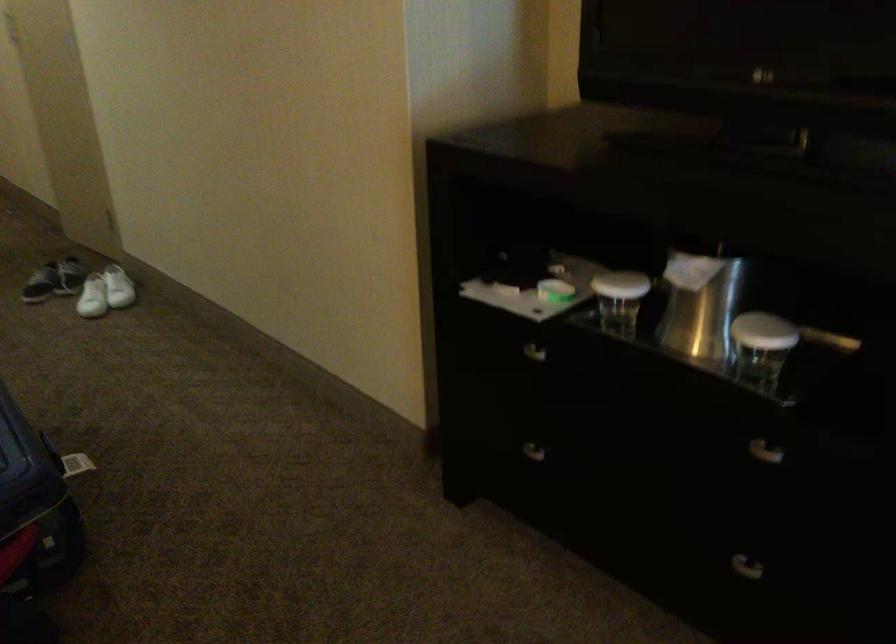
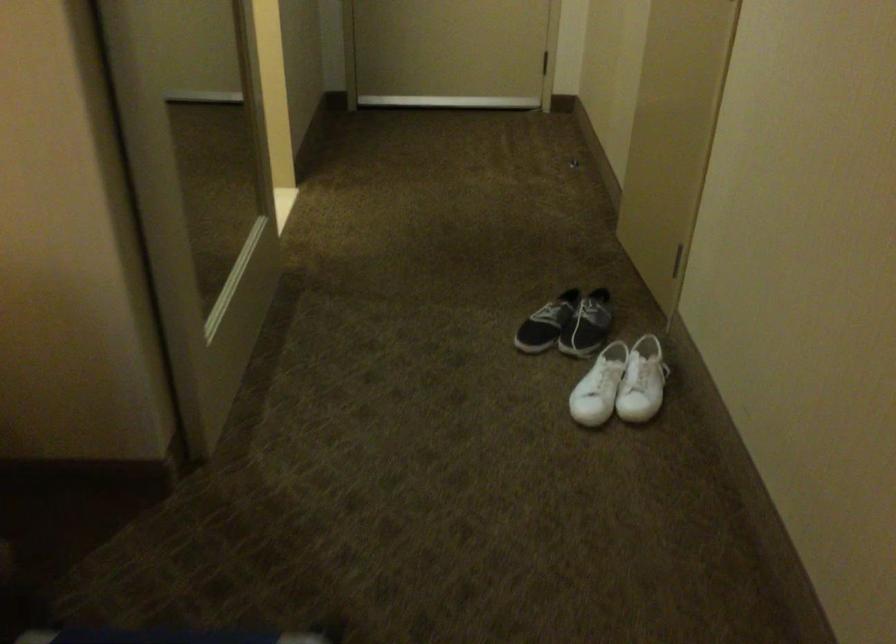
The point at (82, 294) is marked in the first image. Where is the corresponding point in the second image?

(599, 386)